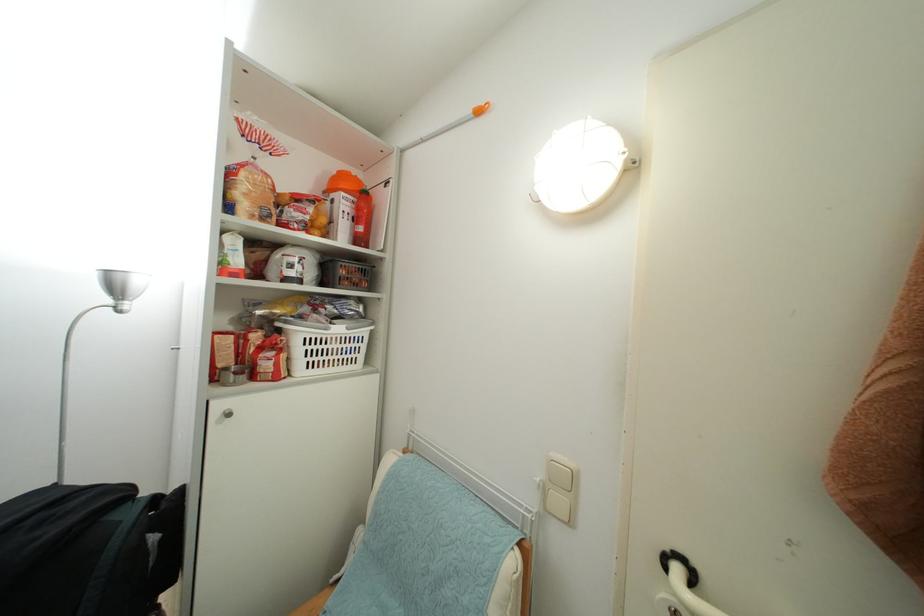
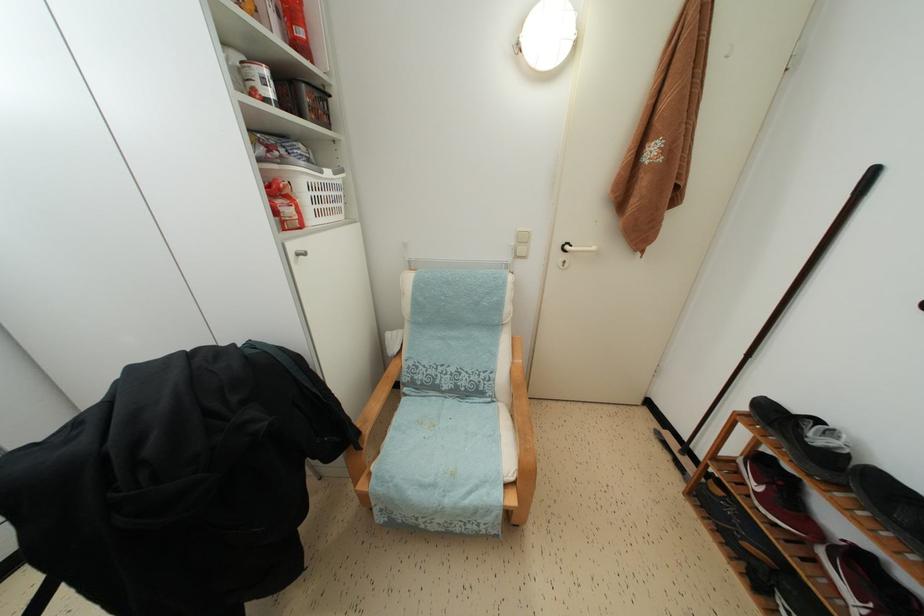
In the second image, find the point that corresponds to point 682,575 in the first image.

(572, 253)